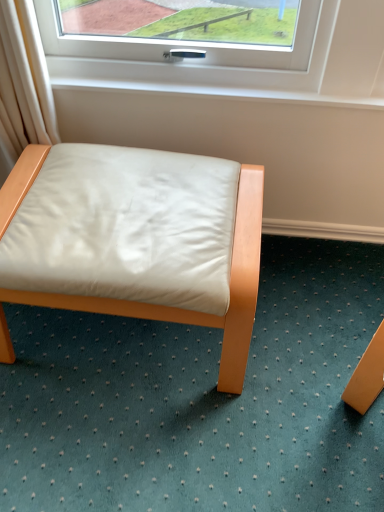
Locate an element on the screen. This screenshot has width=384, height=512. vacant area in front of white leather ottoman at center is located at coordinates (142, 441).